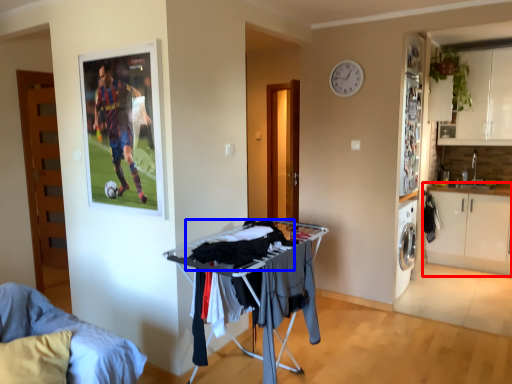
Question: Which object is further to the camera taking this photo, cabinetry (highlighted by a red box) or laundry (highlighted by a blue box)?

Choices:
 (A) cabinetry
 (B) laundry

Answer: (A)